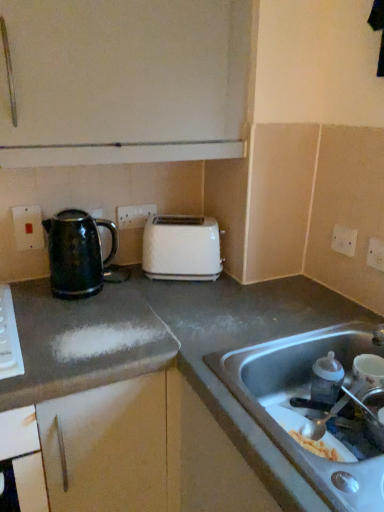
Question: Considering the positions of point (19, 245) and point (380, 266), is point (19, 245) closer or farther from the camera than point (380, 266)?

Choices:
 (A) farther
 (B) closer

Answer: (A)

Question: In the image, is matte plastic electric outlet at upper left, placed as the 4th electric outlet when sorted from right to left, positioned in front of or behind white plastic electric outlet at upper right, positioned as the fourth electric outlet in back-to-front order?

Choices:
 (A) front
 (B) behind

Answer: (B)

Question: Which is farther from the white plastic toaster at center?

Choices:
 (A) gray matte countertop at center, which appears as the 1th countertop when viewed from the right
 (B) shiny metallic kettle at center-left, placed as the 1th countertop when sorted from left to right
 (C) matte plastic electric outlet at upper left, placed as the 4th electric outlet when sorted from right to left
 (D) stainless steel sink at lower right
 (E) white plastic electric outlet at center, placed as the second electric outlet when sorted from left to right

Answer: (D)

Question: Which of these objects is positioned closest to the gray matte countertop at center, which appears as the 1th countertop when viewed from the right?

Choices:
 (A) white plastic toaster at center
 (B) matte plastic electric outlet at upper left, placed as the 3th electric outlet when sorted from front to back
 (C) stainless steel sink at lower right
 (D) white plastic electric outlet at upper right, the fourth electric outlet from the left
 (E) metallic silver faucet at sink right

Answer: (C)